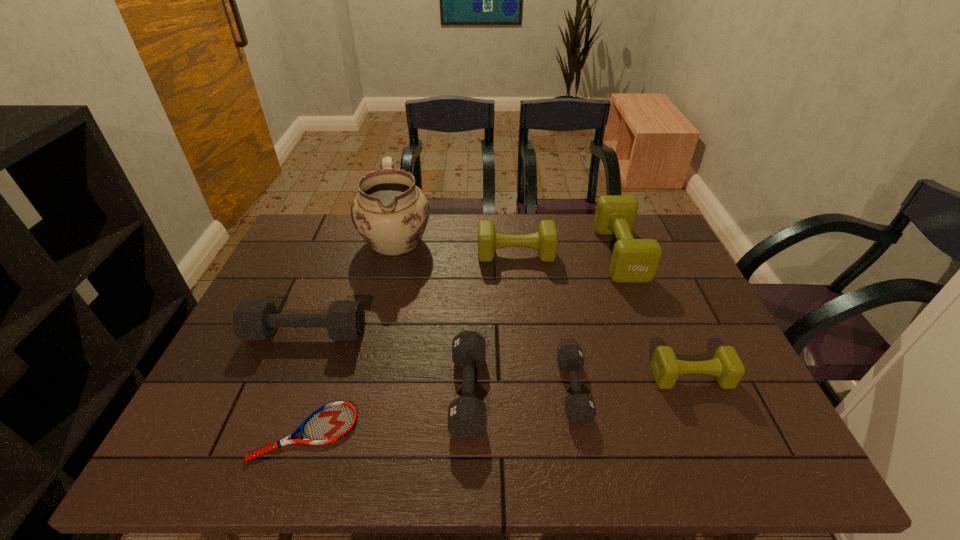
Identify the location of free spot located on the back of the shortest object. Image resolution: width=960 pixels, height=540 pixels. (350, 295).

Identify the location of pitcher at the far edge. The height and width of the screenshot is (540, 960). (390, 212).

Identify the location of dumbbell at the near edge. The width and height of the screenshot is (960, 540). (466, 415).

Locate an element on the screen. Image resolution: width=960 pixels, height=540 pixels. tennis racket situated at the near edge is located at coordinates (331, 422).

What are the coordinates of `dumbbell at the left edge` in the screenshot? It's located at (252, 319).

Identify the location of tennis racket located in the left edge section of the desktop. (331, 422).

At what (x,y) coordinates should I click in order to perform the action: click on object that is at the near left corner. Please return your answer as a coordinate pair (x, y). This screenshot has width=960, height=540. Looking at the image, I should click on pos(331,422).

At what (x,y) coordinates should I click in order to perform the action: click on object that is at the far right corner. Please return your answer as a coordinate pair (x, y). This screenshot has width=960, height=540. Looking at the image, I should click on (633, 260).

Image resolution: width=960 pixels, height=540 pixels. In order to click on vacant position at the far edge of the desktop in this screenshot , I will do `click(562, 238)`.

This screenshot has height=540, width=960. What are the coordinates of `vacant space at the left edge of the desktop` in the screenshot? It's located at (302, 291).